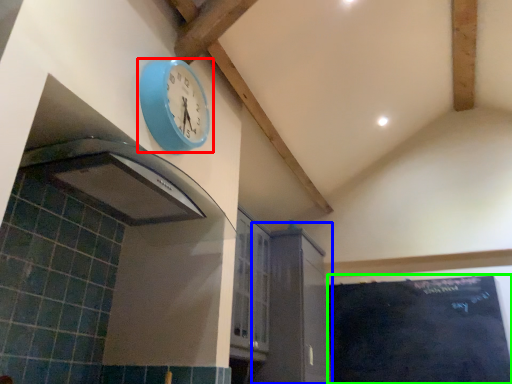
Question: Based on their relative distances, which object is farther from wall clock (highlighted by a red box)? Choose from cabinetry (highlighted by a blue box) and bulletin board (highlighted by a green box).

Choices:
 (A) cabinetry
 (B) bulletin board

Answer: (B)